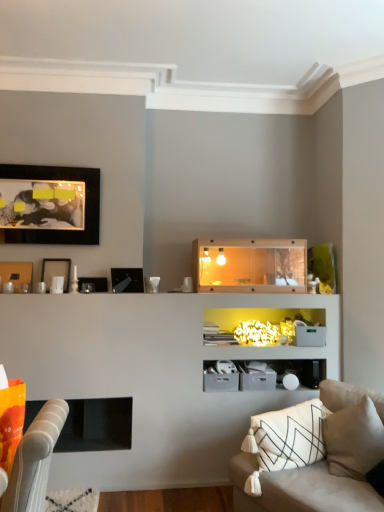
Question: Is metallic black picture frame at upper left, the 2th picture frame when ordered from bottom to top, turned away from white soft pillow at lower right?

Choices:
 (A) yes
 (B) no

Answer: (B)

Question: From the image's perspective, is metallic black picture frame at upper left, the 2th picture frame when ordered from bottom to top, located above white soft pillow at lower right?

Choices:
 (A) yes
 (B) no

Answer: (A)

Question: Is metallic black picture frame at upper left, the 3th picture frame positioned from the top, with white soft pillow at lower right?

Choices:
 (A) no
 (B) yes

Answer: (A)

Question: Is metallic black picture frame at upper left, the 2th picture frame when ordered from bottom to top, to the left of white soft pillow at lower right from the viewer's perspective?

Choices:
 (A) yes
 (B) no

Answer: (A)

Question: From a real-world perspective, is metallic black picture frame at upper left, the 2th picture frame when ordered from bottom to top, physically above white soft pillow at lower right?

Choices:
 (A) yes
 (B) no

Answer: (A)

Question: Is metallic black picture frame at upper left, the 2th picture frame when ordered from bottom to top, in front of white soft pillow at lower right?

Choices:
 (A) no
 (B) yes

Answer: (A)

Question: Considering the relative sizes of beige fabric couch at lower right and white matte picture frame at upper left, the 3th picture frame in the bottom-to-top sequence, in the image provided, is beige fabric couch at lower right smaller than white matte picture frame at upper left, the 3th picture frame in the bottom-to-top sequence,?

Choices:
 (A) yes
 (B) no

Answer: (B)

Question: Is there a large distance between beige fabric couch at lower right and white matte picture frame at upper left, the 3th picture frame in the bottom-to-top sequence?

Choices:
 (A) yes
 (B) no

Answer: (A)

Question: Is beige fabric couch at lower right positioned beyond the bounds of white matte picture frame at upper left, which is the second picture frame from top to bottom?

Choices:
 (A) yes
 (B) no

Answer: (A)

Question: Is beige fabric couch at lower right shorter than white matte picture frame at upper left, the 3th picture frame in the bottom-to-top sequence?

Choices:
 (A) no
 (B) yes

Answer: (A)

Question: From the image's perspective, is beige fabric couch at lower right located above white matte picture frame at upper left, which is the second picture frame from top to bottom?

Choices:
 (A) no
 (B) yes

Answer: (A)

Question: Is beige fabric couch at lower right facing towards white matte picture frame at upper left, the 3th picture frame in the bottom-to-top sequence?

Choices:
 (A) yes
 (B) no

Answer: (B)

Question: Does matte black picture frame at upper left, arranged as the 1th picture frame when viewed from the top, have a smaller size compared to beige fabric couch at lower right?

Choices:
 (A) yes
 (B) no

Answer: (A)